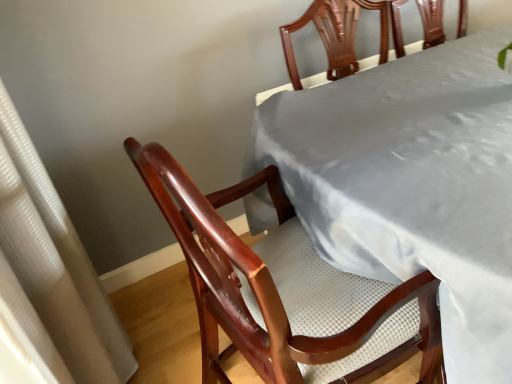
Image resolution: width=512 pixels, height=384 pixels. What are the coordinates of `satin gray tablecloth at upper center` in the screenshot? It's located at (411, 184).

Describe the element at coordinates (411, 184) in the screenshot. I see `satin gray tablecloth at upper center` at that location.

What is the approximate height of white textured curtain at left?

white textured curtain at left is 1.20 meters tall.

I want to click on white textured curtain at left, so click(x=51, y=270).

Describe the element at coordinates (51, 270) in the screenshot. The width and height of the screenshot is (512, 384). I see `white textured curtain at left` at that location.

At what (x,y) coordinates should I click in order to perform the action: click on satin gray tablecloth at upper center. Please return your answer as a coordinate pair (x, y). The image size is (512, 384). Looking at the image, I should click on (411, 184).

Based on the photo, considering the positions of objects satin gray tablecloth at upper center and white textured curtain at left in the image provided, who is more to the left, satin gray tablecloth at upper center or white textured curtain at left?

Positioned to the left is white textured curtain at left.

Between satin gray tablecloth at upper center and white textured curtain at left, which one is positioned in front?

white textured curtain at left is in front.

Is point (328, 180) farther from viewer compared to point (61, 221)?

No, it is not.

From the image's perspective, does satin gray tablecloth at upper center appear lower than white textured curtain at left?

Incorrect, from the image's perspective, satin gray tablecloth at upper center is higher than white textured curtain at left.

From a real-world perspective, is satin gray tablecloth at upper center under white textured curtain at left?

Yes.

Does satin gray tablecloth at upper center have a lesser width compared to white textured curtain at left?

No.

Based on the photo, in terms of height, does satin gray tablecloth at upper center look taller or shorter compared to white textured curtain at left?

In the image, satin gray tablecloth at upper center appears to be shorter than white textured curtain at left.

Who is bigger, satin gray tablecloth at upper center or white textured curtain at left?

satin gray tablecloth at upper center is bigger.

Is satin gray tablecloth at upper center outside of white textured curtain at left?

satin gray tablecloth at upper center lies outside white textured curtain at left's area.

Is satin gray tablecloth at upper center positioned far away from white textured curtain at left?

satin gray tablecloth at upper center is actually quite close to white textured curtain at left.

Is satin gray tablecloth at upper center aimed at white textured curtain at left?

No, satin gray tablecloth at upper center is not facing towards white textured curtain at left.

The height and width of the screenshot is (384, 512). Find the location of `table above the white textured curtain at left (from the image's perspective)`. table above the white textured curtain at left (from the image's perspective) is located at coordinates (411, 184).

Which object is positioned more to the left, white textured curtain at left or satin gray tablecloth at upper center?

white textured curtain at left is more to the left.

Which object is more forward, white textured curtain at left or satin gray tablecloth at upper center?

white textured curtain at left.

Does point (1, 132) come farther from viewer compared to point (266, 165)?

No, (1, 132) is in front of (266, 165).

From the image's perspective, who appears lower, white textured curtain at left or satin gray tablecloth at upper center?

white textured curtain at left appears lower in the image.

From a real-world perspective, is white textured curtain at left positioned over satin gray tablecloth at upper center based on gravity?

Yes, from a real-world perspective, white textured curtain at left is above satin gray tablecloth at upper center.

Does white textured curtain at left have a greater width compared to satin gray tablecloth at upper center?

Incorrect, the width of white textured curtain at left does not surpass that of satin gray tablecloth at upper center.

Between white textured curtain at left and satin gray tablecloth at upper center, which one has less height?

satin gray tablecloth at upper center.

Between white textured curtain at left and satin gray tablecloth at upper center, which one has smaller size?

white textured curtain at left.

Looking at this image, can we say white textured curtain at left lies outside satin gray tablecloth at upper center?

Yes, white textured curtain at left is located beyond the bounds of satin gray tablecloth at upper center.

Is white textured curtain at left far away from satin gray tablecloth at upper center?

white textured curtain at left is near satin gray tablecloth at upper center, not far away.

Is satin gray tablecloth at upper center at the back of white textured curtain at left?

No, white textured curtain at left is not facing away from satin gray tablecloth at upper center.

In the image, there is a white textured curtain at left. Identify the location of table below it (from a real-world perspective). The image size is (512, 384). (411, 184).

This screenshot has height=384, width=512. In order to click on table on the right side of white textured curtain at left in this screenshot , I will do `click(411, 184)`.

Locate an element on the screen. This screenshot has height=384, width=512. curtain above the satin gray tablecloth at upper center (from a real-world perspective) is located at coordinates (51, 270).